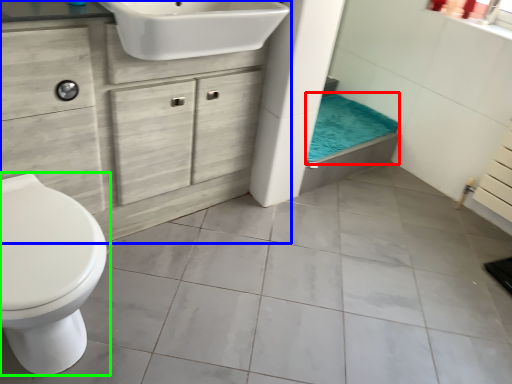
Question: Considering the real-world distances, which object is closest to bath towel (highlighted by a red box)? bathroom cabinet (highlighted by a blue box) or toilet (highlighted by a green box).

Choices:
 (A) bathroom cabinet
 (B) toilet

Answer: (A)